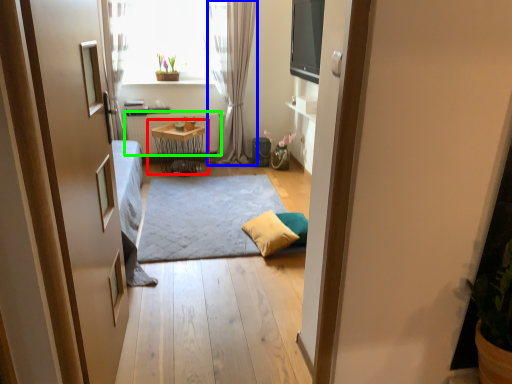
Question: Estimate the real-world distances between objects in this image. Which object is farther from table (highlighted by a red box), curtain (highlighted by a blue box) or radiator (highlighted by a green box)?

Choices:
 (A) curtain
 (B) radiator

Answer: (A)